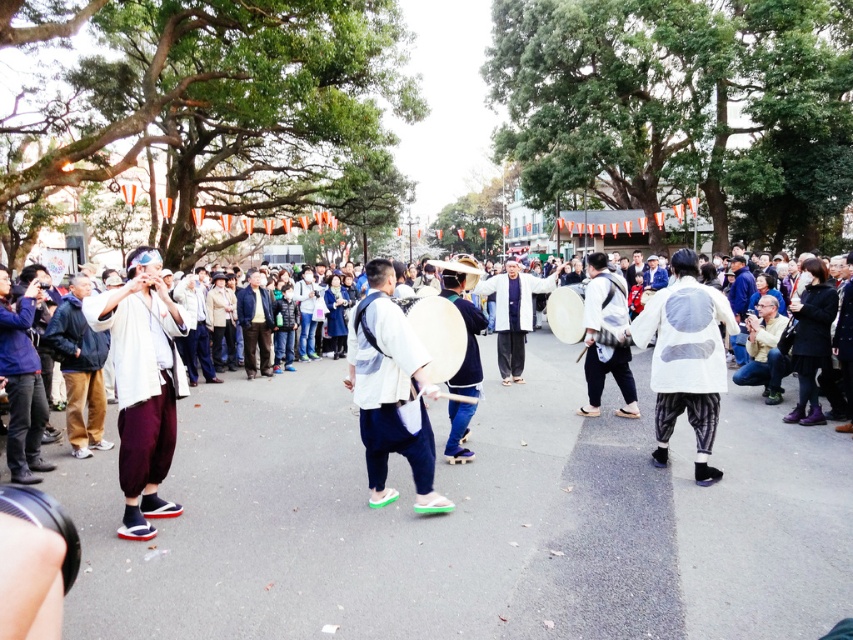
You are a photographer at the festival. You want to capture a photo that includes both the white cotton kimono at left and the white matte drum at center. Based on their positions, which object should you focus on first to ensure both are in the frame?

The white cotton kimono at left is located above the white matte drum at center, so you should focus on the white cotton kimono at left first to ensure both are in the frame.

You are a photographer at the festival and want to capture both the white cotton drum at center and the white matte drum at center in the same frame. Which drum should you position closer to the left side of your camera viewfinder to include both?

To include both the white cotton drum at center and the white matte drum at center in the same frame, position the white matte drum at center closer to the left side of your camera viewfinder since the white cotton drum at center is to the right of the white matte drum at center.

You are a photographer at the festival. You want to take a photo of both the white cotton drum at center and the white cotton kimono at left. Which object should you focus on first to ensure both are in the frame?

The white cotton kimono at left is to the left of the white cotton drum at center, so you should focus on the white cotton kimono at left first to ensure both are in the frame.